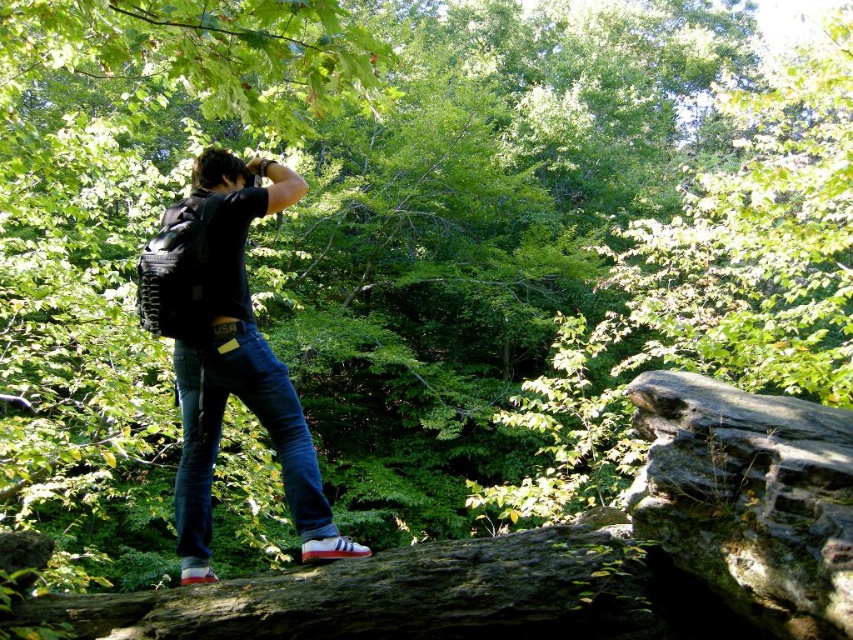
Question: Is brown rough tree trunk at lower center above denim jeans at center?

Choices:
 (A) yes
 (B) no

Answer: (B)

Question: Is brown rough tree trunk at lower center bigger than blue denim jeans at center?

Choices:
 (A) no
 (B) yes

Answer: (B)

Question: Based on their relative distances, which object is nearer to the brown rough tree trunk at lower center?

Choices:
 (A) denim jeans at center
 (B) blue denim jeans at center

Answer: (B)

Question: Which point is closer to the camera?

Choices:
 (A) (299, 476)
 (B) (532, 564)
 (C) (190, 496)

Answer: (B)

Question: Can you confirm if brown rough tree trunk at lower center is bigger than blue denim jeans at center?

Choices:
 (A) no
 (B) yes

Answer: (B)

Question: Which point appears farthest from the camera in this image?

Choices:
 (A) pos(322,493)
 (B) pos(364,628)

Answer: (A)